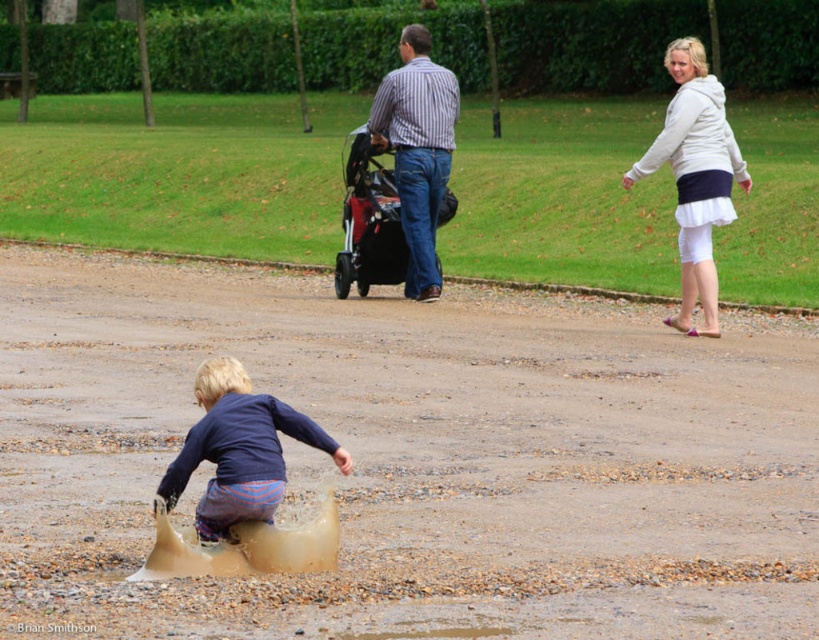
You are a child playing in the puddle and want to walk to the smooth concrete path at center. Which direction should you move relative to the blue cotton shirt at lower left?

You should move away from the blue cotton shirt at lower left because the smooth concrete path at center is further to the viewer than the blue cotton shirt at lower left, meaning it is located in the opposite direction from the shirt.

Looking at this image, you are a delivery drone flying over the park. You need to land on the smooth concrete path at center to deliver a package. However, there is a blue cotton shirt at lower left in the way. Can you safely land on the path without hitting the shirt?

The smooth concrete path at center is taller than blue cotton shirt at lower left, so yes, the drone can safely land on the smooth concrete path at center without hitting the blue cotton shirt at lower left since the path is elevated above the shirt.